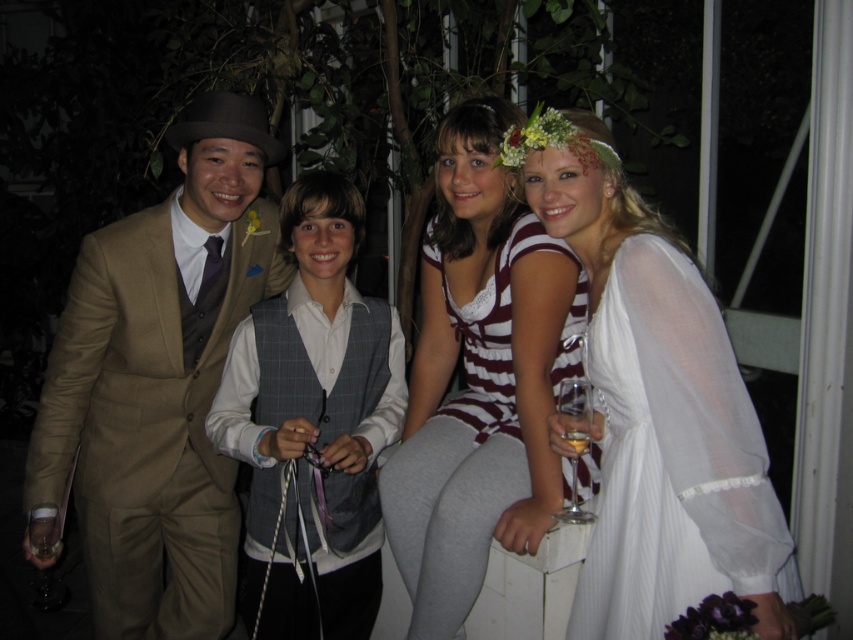
Question: Does striped fabric dress at center appear over white sheer dress at center?

Choices:
 (A) yes
 (B) no

Answer: (B)

Question: Which object is positioned closest to the gray checkered vest at center?

Choices:
 (A) white sheer dress at center
 (B) matte brown suit at left

Answer: (B)

Question: Is matte brown suit at left behind white sheer dress at right?

Choices:
 (A) yes
 (B) no

Answer: (A)

Question: Which object is farther from the camera taking this photo?

Choices:
 (A) clear glass wine glass at lower right
 (B) matte brown suit at left
 (C) striped fabric dress at center

Answer: (B)

Question: Which object is farther from the camera taking this photo?

Choices:
 (A) gray checkered vest at center
 (B) white sheer dress at center
 (C) white sheer dress at right
 (D) striped fabric dress at center

Answer: (B)

Question: Is striped fabric dress at center to the left of clear glass wine glass at lower right from the viewer's perspective?

Choices:
 (A) yes
 (B) no

Answer: (A)